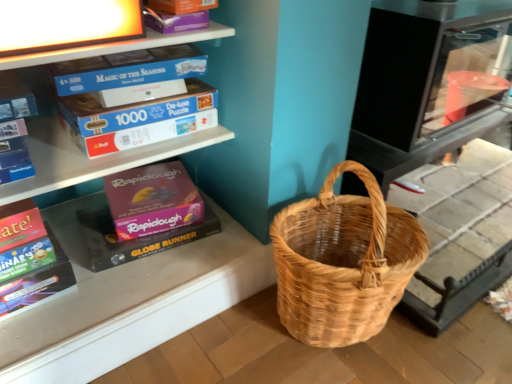
Question: Are white cardboard puzzle boxes at upper left and multicolored cardboard book at lower left making contact?

Choices:
 (A) yes
 (B) no

Answer: (B)

Question: Is white cardboard puzzle boxes at upper left looking in the opposite direction of multicolored cardboard book at lower left?

Choices:
 (A) no
 (B) yes

Answer: (A)

Question: From a real-world perspective, is white cardboard puzzle boxes at upper left on multicolored cardboard book at lower left?

Choices:
 (A) no
 (B) yes

Answer: (B)

Question: From the image's perspective, is white cardboard puzzle boxes at upper left below multicolored cardboard book at lower left?

Choices:
 (A) yes
 (B) no

Answer: (B)

Question: Can you confirm if white cardboard puzzle boxes at upper left is smaller than multicolored cardboard book at lower left?

Choices:
 (A) no
 (B) yes

Answer: (A)

Question: Is natural woven picnic basket at lower right to the left or to the right of multicolored cardboard book at lower left in the image?

Choices:
 (A) right
 (B) left

Answer: (A)

Question: Considering their positions, is natural woven picnic basket at lower right located in front of or behind multicolored cardboard book at lower left?

Choices:
 (A) front
 (B) behind

Answer: (A)

Question: Is point (411, 274) positioned closer to the camera than point (41, 301)?

Choices:
 (A) closer
 (B) farther

Answer: (A)

Question: Is natural woven picnic basket at lower right inside or outside of multicolored cardboard book at lower left?

Choices:
 (A) inside
 (B) outside

Answer: (B)

Question: Would you say multicolored cardboard book at lower left is to the left or to the right of white cardboard puzzle boxes at upper left in the picture?

Choices:
 (A) right
 (B) left

Answer: (B)

Question: Considering the positions of multicolored cardboard book at lower left and white cardboard puzzle boxes at upper left in the image, is multicolored cardboard book at lower left wider or thinner than white cardboard puzzle boxes at upper left?

Choices:
 (A) thin
 (B) wide

Answer: (A)

Question: From a real-world perspective, is multicolored cardboard book at lower left above or below white cardboard puzzle boxes at upper left?

Choices:
 (A) above
 (B) below

Answer: (B)

Question: Which is correct: multicolored cardboard book at lower left is inside white cardboard puzzle boxes at upper left, or outside of it?

Choices:
 (A) inside
 (B) outside

Answer: (B)

Question: Does point (38, 119) appear closer or farther from the camera than point (41, 244)?

Choices:
 (A) farther
 (B) closer

Answer: (A)

Question: Relative to multicolored cardboard book at lower left, is white cardboard puzzle boxes at upper left in front or behind?

Choices:
 (A) front
 (B) behind

Answer: (B)